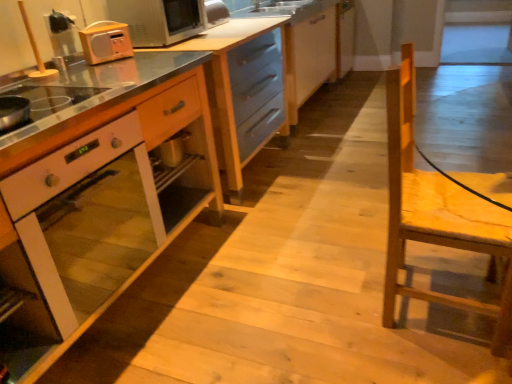
Question: In terms of width, does wooden cabinet at center, arranged as the 1th cabinetry when viewed from the right, look wider or thinner when compared to matte blue cabinet at center, arranged as the first cabinetry when viewed from the left?

Choices:
 (A) thin
 (B) wide

Answer: (A)

Question: Based on their sizes in the image, would you say wooden cabinet at center, positioned as the 3th cabinetry in left-to-right order, is bigger or smaller than matte blue cabinet at center, arranged as the first cabinetry when viewed from the left?

Choices:
 (A) big
 (B) small

Answer: (B)

Question: Estimate the real-world distances between objects in this image. Which object is closer to the wooden cabinet at center, arranged as the 1th cabinetry when viewed from the right?

Choices:
 (A) matte blue cabinet at center, arranged as the first cabinetry when viewed from the left
 (B) white glossy oven at center
 (C) matte orange radio at upper left
 (D) metallic silver microwave at upper left
 (E) wooden cabinet at center, which is the second cabinetry in right-to-left order

Answer: (A)

Question: Which object is the farthest from the wooden cabinet at center, positioned as the 3th cabinetry in left-to-right order?

Choices:
 (A) metallic silver microwave at upper left
 (B) matte orange radio at upper left
 (C) stainless steel countertop at center
 (D) white glossy oven at center
 (E) light brown wooden chair at right

Answer: (E)